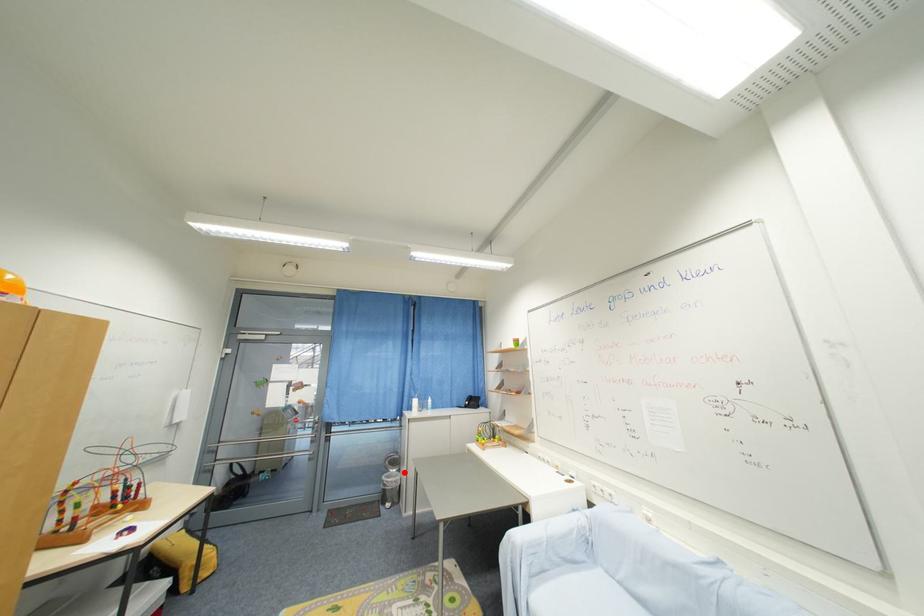
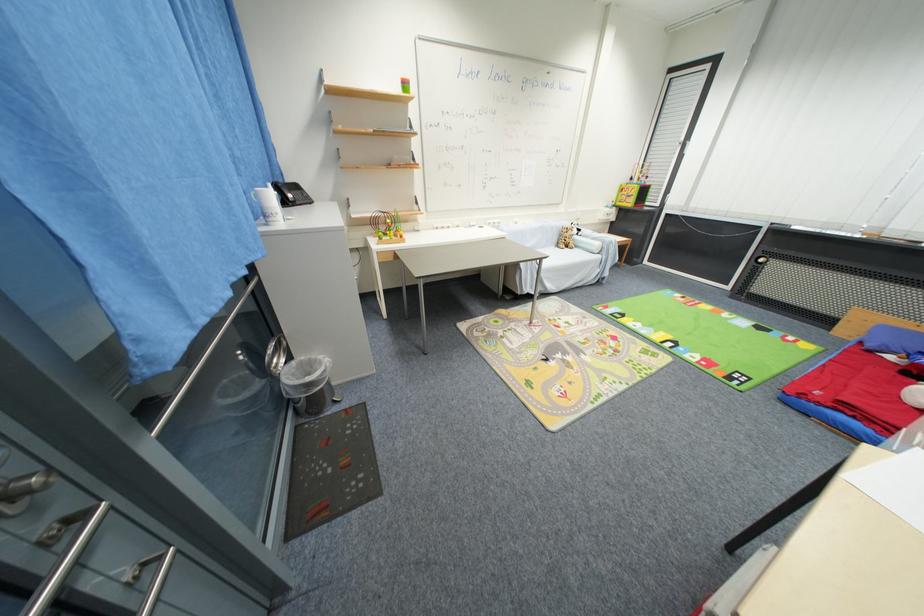
Question: I am providing you with two images of the same scene from different viewpoints. In image1, a red point is highlighted. Considering the same 3D point in image2, which of the following is correct?

Choices:
 (A) It is closer
 (B) It is farther

Answer: (A)